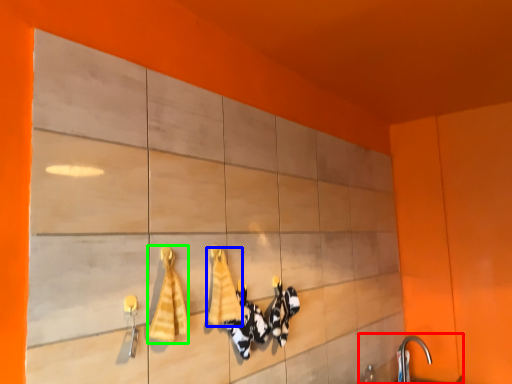
Question: Based on their relative distances, which object is farther from sink (highlighted by a red box)? Choose from bath towel (highlighted by a blue box) and bath towel (highlighted by a green box).

Choices:
 (A) bath towel
 (B) bath towel

Answer: (B)